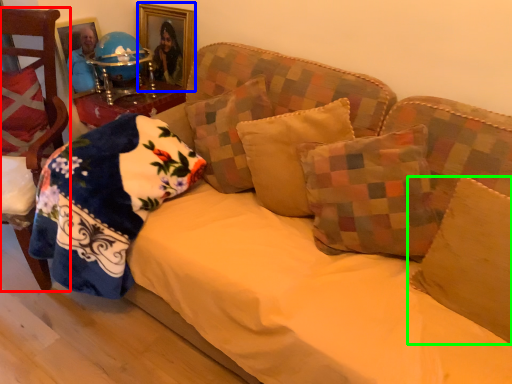
Question: Estimate the real-world distances between objects in this image. Which object is farther from chair (highlighted by a red box), picture frame (highlighted by a blue box) or pillow (highlighted by a green box)?

Choices:
 (A) picture frame
 (B) pillow

Answer: (B)